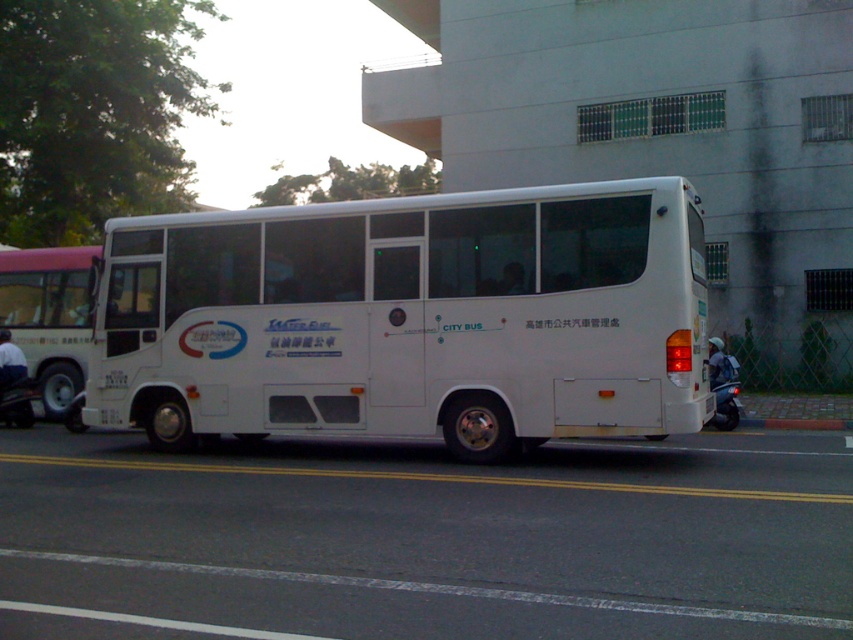
Does white matte bus at center have a lesser width compared to white matte bus at left?

Correct, white matte bus at center's width is less than white matte bus at left's.

Is white matte bus at center to the right of white matte bus at left from the viewer's perspective?

Correct, you'll find white matte bus at center to the right of white matte bus at left.

Between point (169, 288) and point (28, 320), which one is positioned behind?

Positioned behind is point (28, 320).

Find the location of a particular element. This screenshot has height=640, width=853. white matte bus at center is located at coordinates (409, 317).